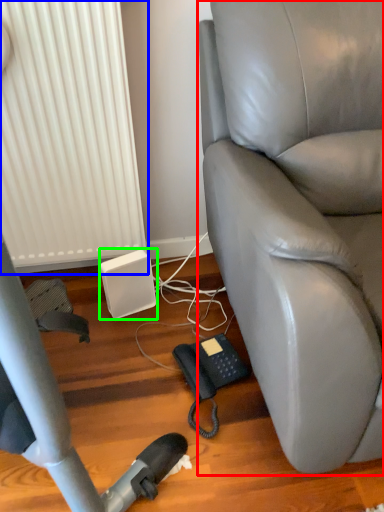
Question: Which object is positioned closest to chair (highlighted by a red box)? Select from radiator (highlighted by a blue box) and speaker (highlighted by a green box).

Choices:
 (A) radiator
 (B) speaker

Answer: (A)